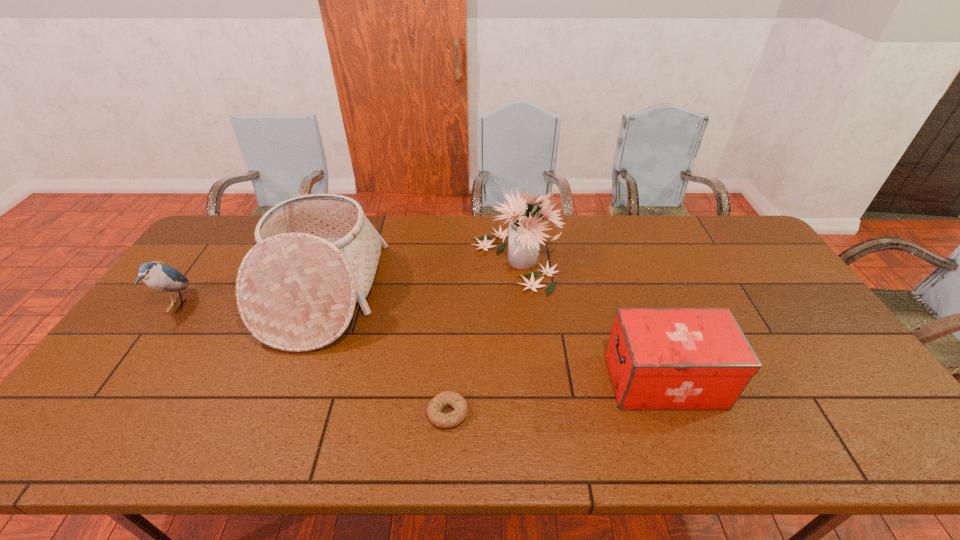
Where is `bouquet`? This screenshot has width=960, height=540. bouquet is located at coordinates pyautogui.click(x=525, y=235).

Where is `basket`? The height and width of the screenshot is (540, 960). basket is located at coordinates (316, 256).

You are a GUI agent. You are given a task and a screenshot of the screen. Output one action in this format:
    pyautogui.click(x=<x>, y=<y>)
    Task: Click on the leftmost object
    The width and height of the screenshot is (960, 540).
    Given the screenshot: What is the action you would take?
    pyautogui.click(x=161, y=277)

At what (x,y) coordinates should I click in order to perform the action: click on the first-aid kit. Please return your answer as a coordinate pair (x, y). The image size is (960, 540). Looking at the image, I should click on (658, 358).

Where is `the shortest object`? This screenshot has width=960, height=540. the shortest object is located at coordinates (455, 400).

Find the location of a particular element. free spot located 0.090m on the right of the bouquet is located at coordinates (587, 260).

Locate an element on the screen. The width and height of the screenshot is (960, 540). vacant space situated with the lid open on the basket is located at coordinates (426, 293).

Identify the location of blank space located at the tip of the leftmost object's beak. (225, 306).

This screenshot has height=540, width=960. What are the coordinates of `free location located 0.300m on the handle side of the first-aid kit` in the screenshot? It's located at (490, 381).

Where is `vacant space situated on the handle side of the first-aid kit`? Image resolution: width=960 pixels, height=540 pixels. vacant space situated on the handle side of the first-aid kit is located at coordinates (529, 381).